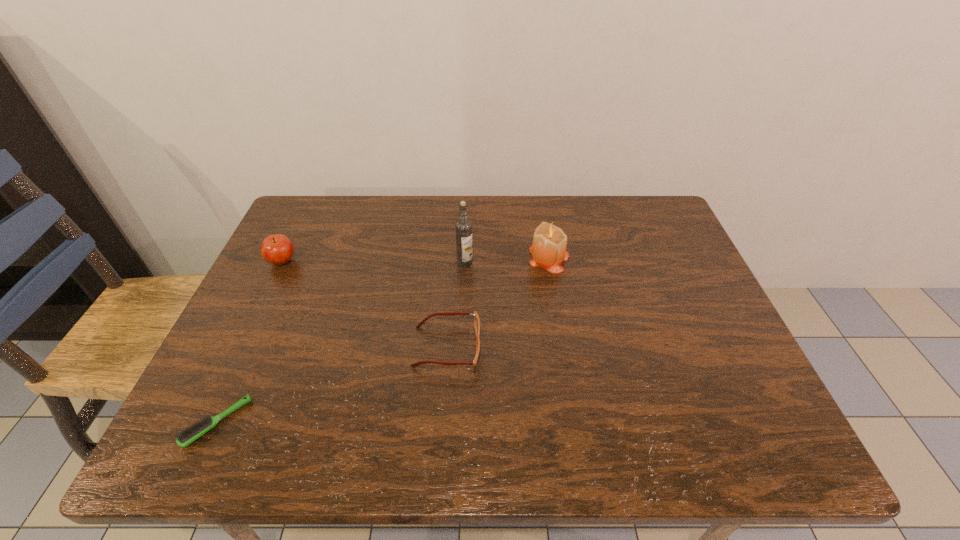
The height and width of the screenshot is (540, 960). What are the coordinates of `vacant space in between the tallest object and the spectacles` in the screenshot? It's located at (456, 305).

I want to click on free space that is in between the shortest object and the apple, so click(250, 342).

Locate which object is the second closest to the shortest object. Please provide its 2D coordinates. Your answer should be formatted as a tuple, i.e. [(x, y)], where the tuple contains the x and y coordinates of a point satisfying the conditions above.

[(277, 249)]

Locate which object ranks third in proximity to the vodka. Please provide its 2D coordinates. Your answer should be formatted as a tuple, i.e. [(x, y)], where the tuple contains the x and y coordinates of a point satisfying the conditions above.

[(277, 249)]

Where is `vacant space that satisfies the following two spatial constraints: 1. on the label of the vodka; 2. on the front-facing side of the fourth farthest object`? The height and width of the screenshot is (540, 960). vacant space that satisfies the following two spatial constraints: 1. on the label of the vodka; 2. on the front-facing side of the fourth farthest object is located at coordinates point(462,347).

Find the location of a particular element. The width and height of the screenshot is (960, 540). vacant space that satisfies the following two spatial constraints: 1. on the label of the vodka; 2. on the front-facing side of the spectacles is located at coordinates (462, 347).